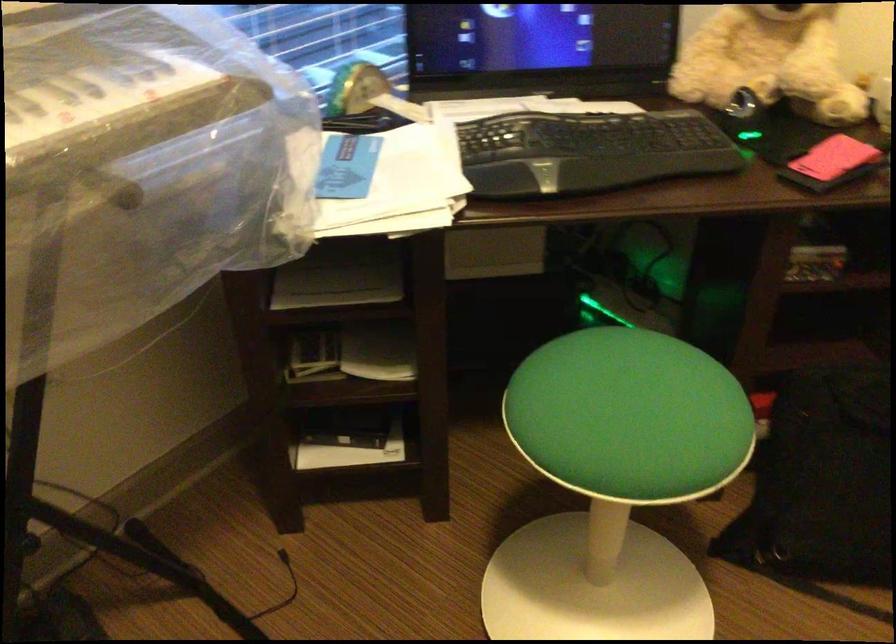
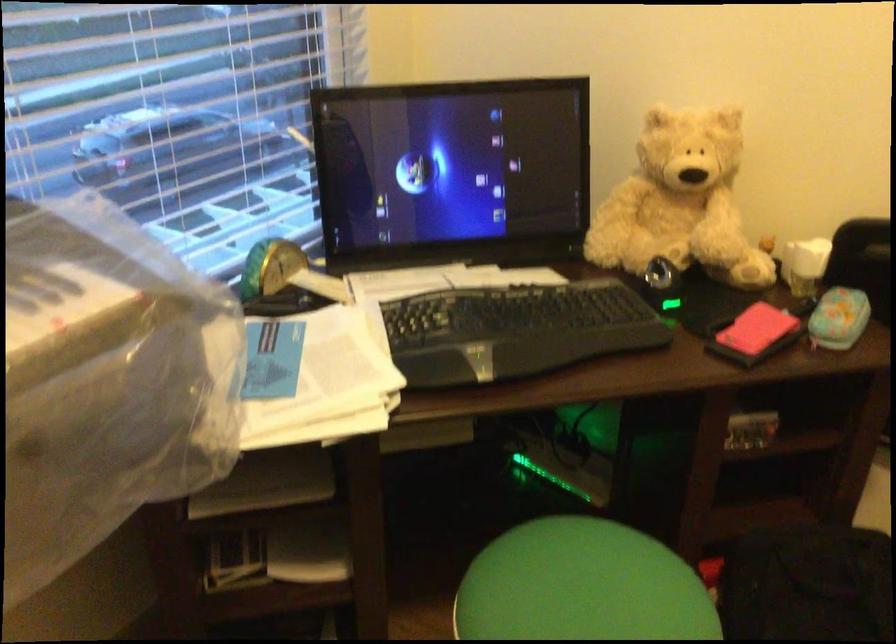
Question: How did the camera likely rotate?

Choices:
 (A) Left
 (B) Right
 (C) Up
 (D) Down

Answer: (C)